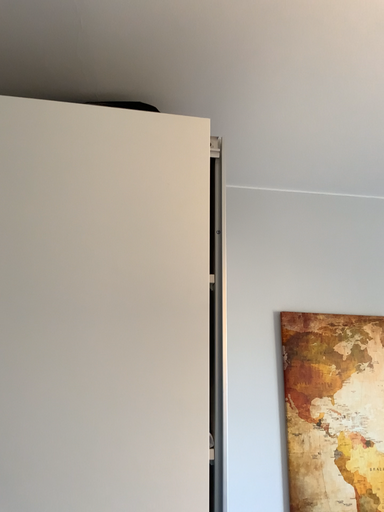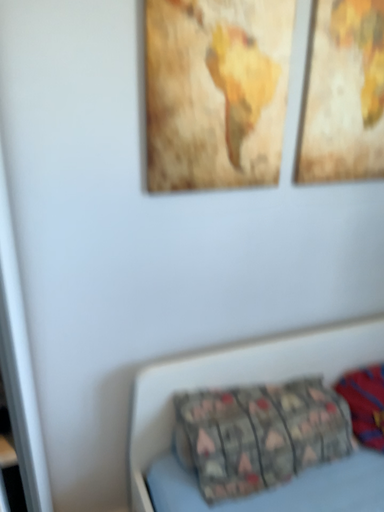
Question: Which way did the camera rotate in the video?

Choices:
 (A) rotated downward
 (B) rotated upward

Answer: (A)